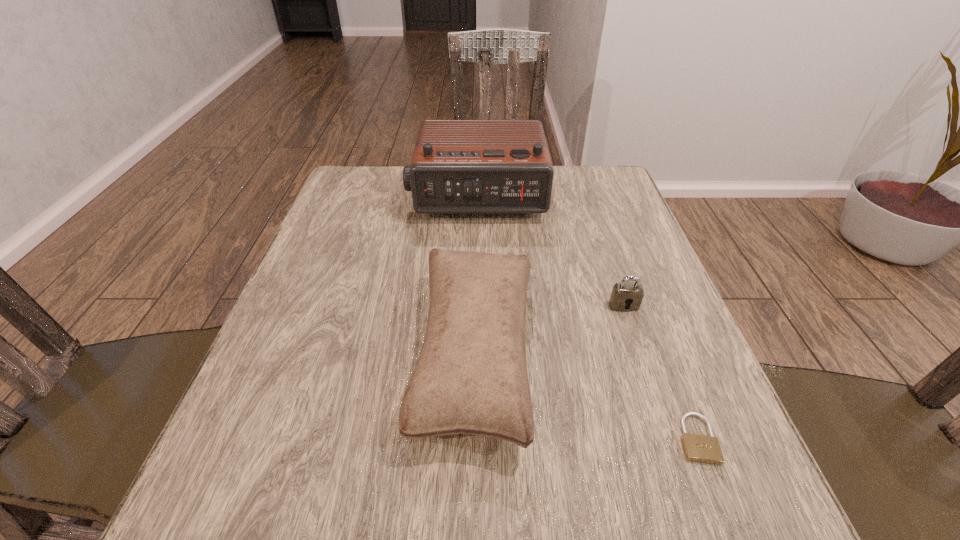
The height and width of the screenshot is (540, 960). I want to click on vacant space located 0.400m on the left of the shorter padlock, so 417,438.

I want to click on object situated at the far edge, so click(x=459, y=166).

Find the location of `blank space at the near edge`. blank space at the near edge is located at coordinates click(514, 532).

Find the location of `vacant space at the left edge of the desktop`. vacant space at the left edge of the desktop is located at coordinates (345, 266).

What are the coordinates of `vacant space at the right edge of the desktop` in the screenshot? It's located at (617, 228).

In the image, there is a desktop. At what (x,y) coordinates should I click in order to perform the action: click on vacant area at the far right corner. Please return your answer as a coordinate pair (x, y). The height and width of the screenshot is (540, 960). Looking at the image, I should click on (598, 176).

Locate an element on the screen. The height and width of the screenshot is (540, 960). unoccupied position between the nearer padlock and the farthest object is located at coordinates (587, 317).

You are a GUI agent. You are given a task and a screenshot of the screen. Output one action in this format:
    pyautogui.click(x=<x>, y=<y>)
    Task: Click on the free area in between the cushion and the nearer padlock
    The width and height of the screenshot is (960, 540).
    Given the screenshot: What is the action you would take?
    pyautogui.click(x=586, y=396)

Where is `unoccupied area between the third shortest object and the nearer padlock`? The image size is (960, 540). unoccupied area between the third shortest object and the nearer padlock is located at coordinates (586, 396).

Locate an element on the screen. The width and height of the screenshot is (960, 540). vacant area between the nearer padlock and the tallest object is located at coordinates (587, 317).